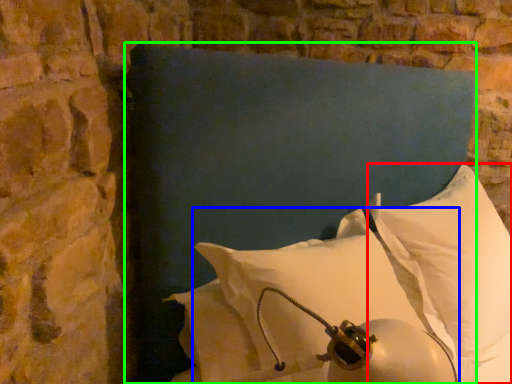
Question: Based on their relative distances, which object is nearer to pillow (highlighted by a red box)? Choose from pillow (highlighted by a blue box) and pillow (highlighted by a green box).

Choices:
 (A) pillow
 (B) pillow

Answer: (B)